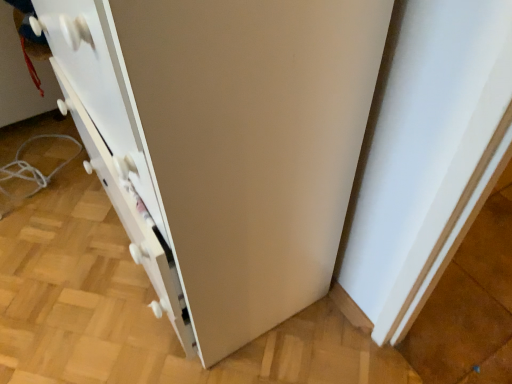
The width and height of the screenshot is (512, 384). Describe the element at coordinates (222, 144) in the screenshot. I see `white glossy cupboard at center` at that location.

What is the approximate height of white glossy cupboard at center?

34.08 inches.

At what (x,y) coordinates should I click in order to perform the action: click on white glossy cupboard at center. Please return your answer as a coordinate pair (x, y). The height and width of the screenshot is (384, 512). Looking at the image, I should click on (222, 144).

The image size is (512, 384). In order to click on white glossy cupboard at center in this screenshot , I will do `click(222, 144)`.